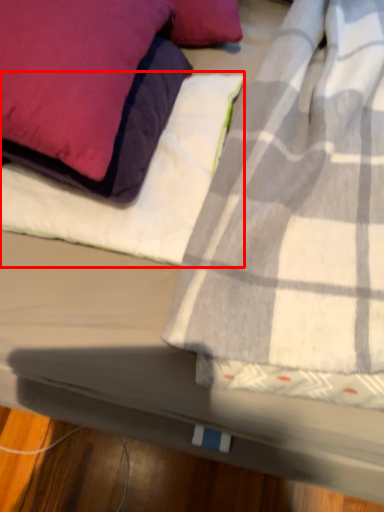
Question: In this image, where is sheet (annotated by the red box) located relative to pillow?

Choices:
 (A) right
 (B) left

Answer: (A)